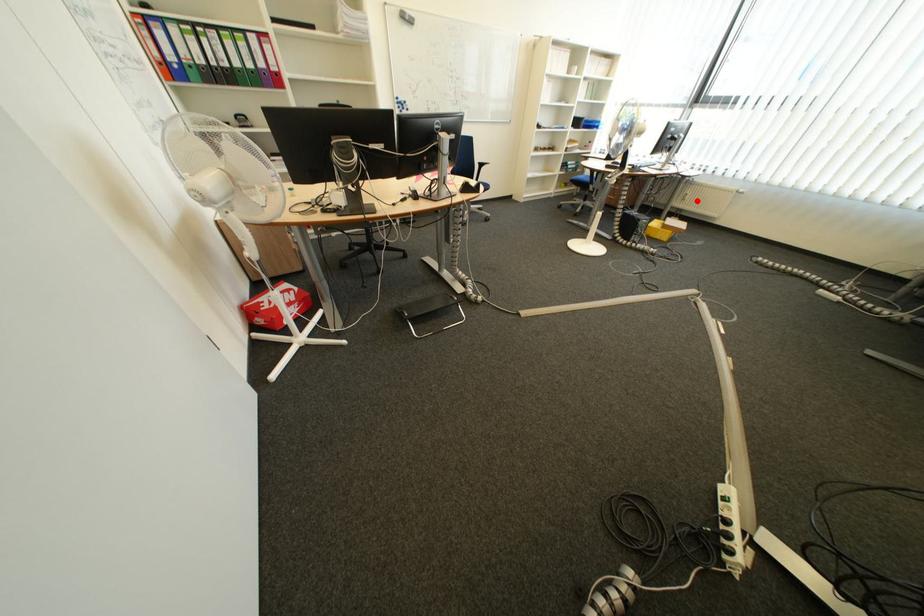
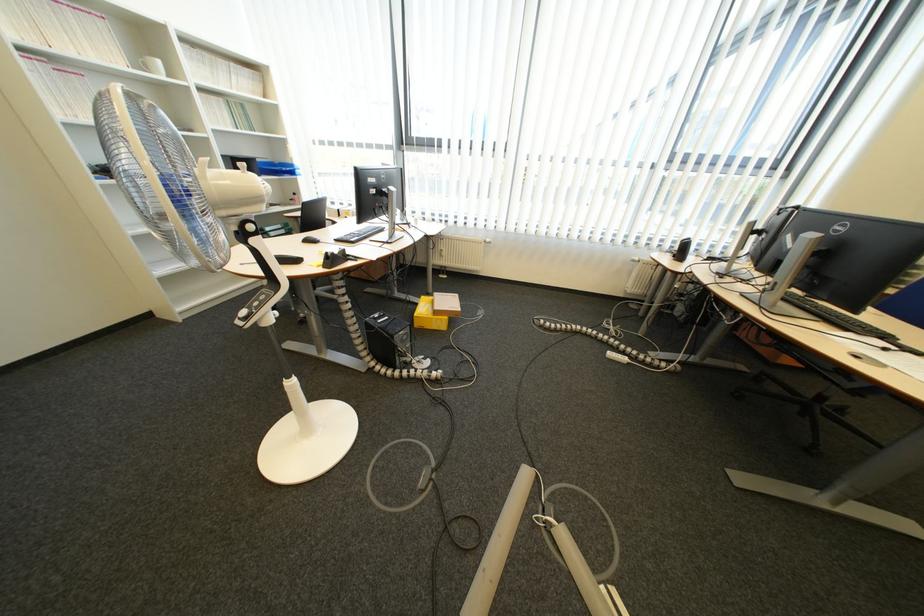
Question: I am providing you with two images of the same scene from different viewpoints. A red point is shown in image1. For the corresponding object point in image2, is it positioned nearer or farther from the camera?

Choices:
 (A) Nearer
 (B) Farther

Answer: (B)